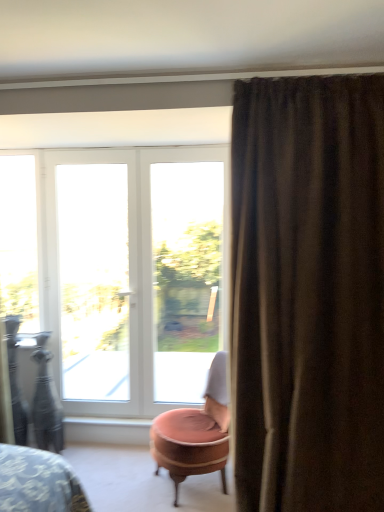
This screenshot has width=384, height=512. I want to click on empty space that is ontop of white plastic window at center, which is the first window from right to left, so click(183, 147).